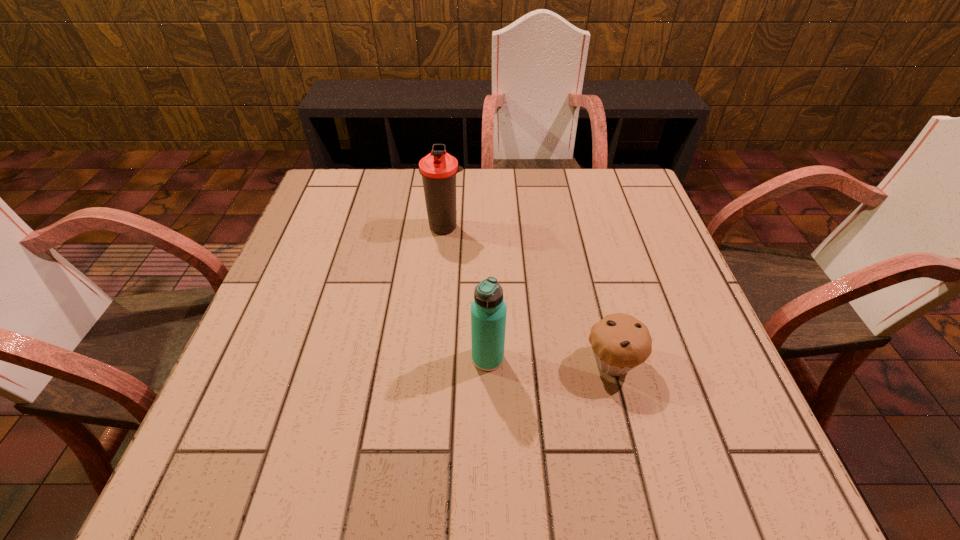
You are a GUI agent. You are given a task and a screenshot of the screen. Output one action in this format:
    pyautogui.click(x=<x>, y=<y>)
    Task: Click on the vacant space that satisfies the following two spatial constraints: 1. on the front side of the second object from right to left; 2. on the right side of the muffin
    The width and height of the screenshot is (960, 540).
    Given the screenshot: What is the action you would take?
    pyautogui.click(x=488, y=362)

Image resolution: width=960 pixels, height=540 pixels. Find the location of `free space that satisfies the following two spatial constraints: 1. on the front side of the muffin; 2. on the left side of the nearer thermos bottle`. free space that satisfies the following two spatial constraints: 1. on the front side of the muffin; 2. on the left side of the nearer thermos bottle is located at coordinates (488, 362).

The width and height of the screenshot is (960, 540). I want to click on free location that satisfies the following two spatial constraints: 1. on the front side of the second object from left to right; 2. on the right side of the muffin, so click(488, 362).